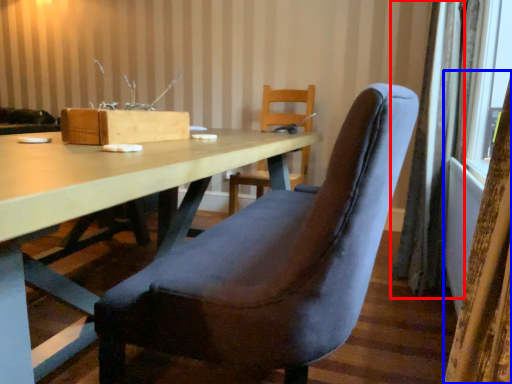
Question: Among these objects, which one is nearest to the camera, curtain (highlighted by a red box) or curtain (highlighted by a blue box)?

Choices:
 (A) curtain
 (B) curtain

Answer: (B)